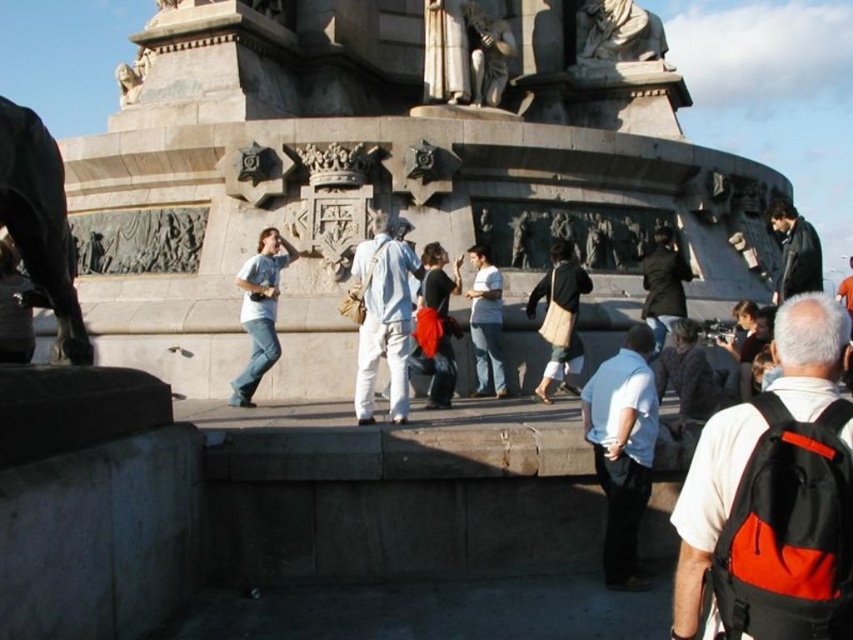
Question: Which is farther from the white matte shirt at center?

Choices:
 (A) black leather jacket at upper right
 (B) white cotton shirt at center

Answer: (A)

Question: Which of the following is the closest to the observer?

Choices:
 (A) (636, 385)
 (B) (550, 353)
 (C) (395, 337)

Answer: (A)

Question: Considering the real-world distances, which object is closest to the black leather jacket at upper right?

Choices:
 (A) black/red backpack at center-right
 (B) black cotton bag at center
 (C) white matte shirt at center

Answer: (B)

Question: In this image, where is white matte shirt at center located relative to black leather jacket at upper right?

Choices:
 (A) right
 (B) left

Answer: (B)

Question: Can you confirm if matte black jacket at center is wider than white cotton shirt at center?

Choices:
 (A) no
 (B) yes

Answer: (B)

Question: Where is matte black jacket at center located in relation to white cotton shirt at center in the image?

Choices:
 (A) right
 (B) left

Answer: (B)